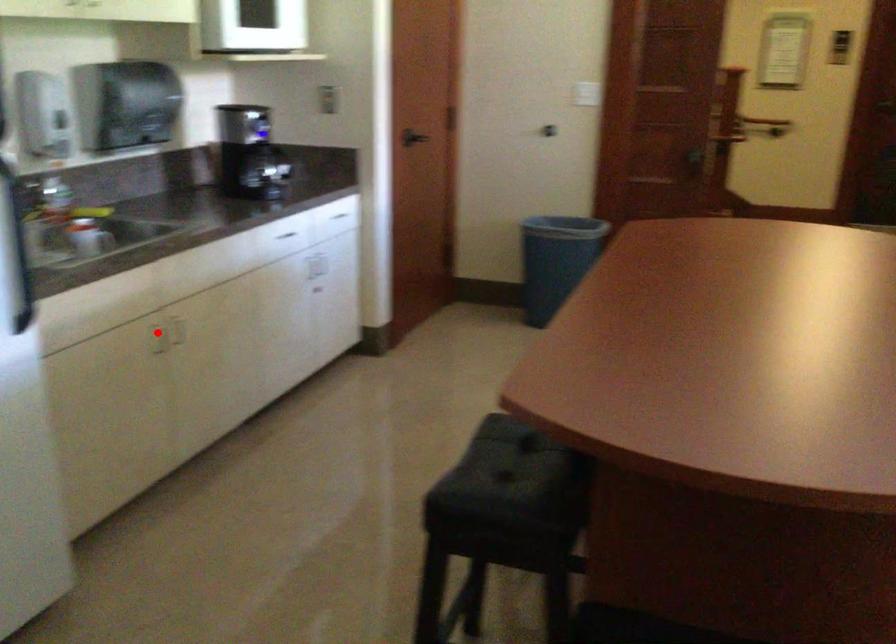
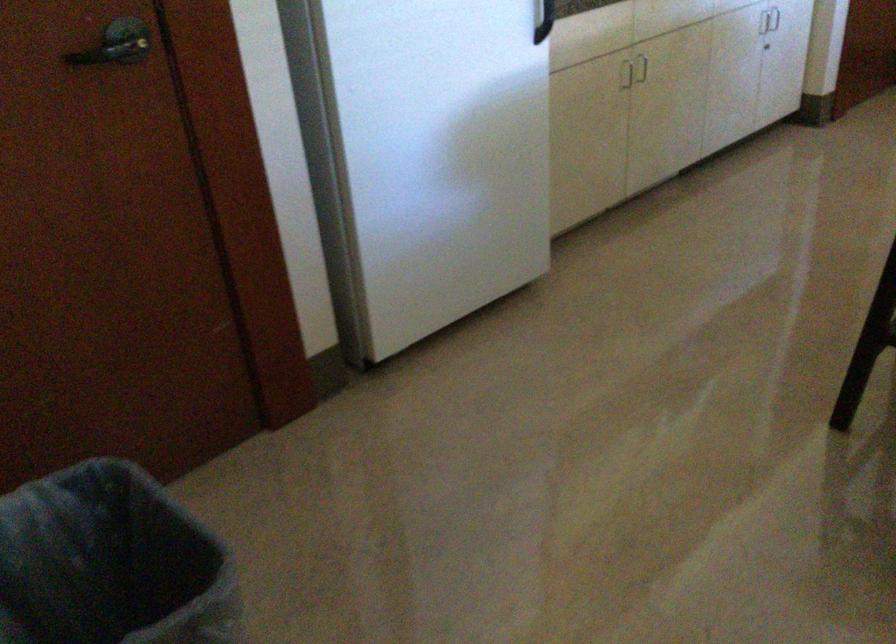
Question: A red point is marked in image1. In image2, is the corresponding 3D point closer to the camera or farther? Reply with the corresponding letter.

Choices:
 (A) The corresponding 3D point is closer.
 (B) The corresponding 3D point is farther.

Answer: (B)